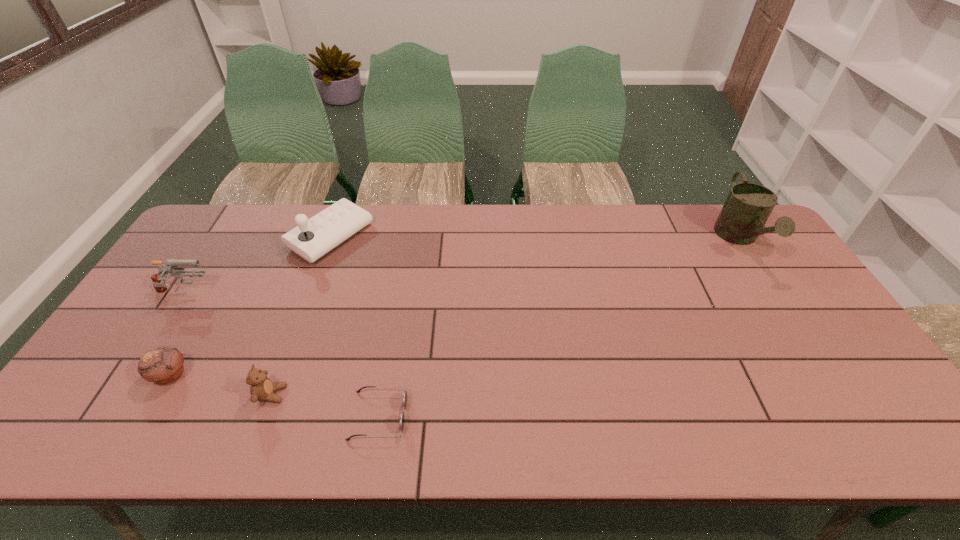
This screenshot has width=960, height=540. In order to click on object that is at the right edge in this screenshot , I will do `click(748, 206)`.

At what (x,y) coordinates should I click in order to perform the action: click on object present at the far right corner. Please return your answer as a coordinate pair (x, y). The height and width of the screenshot is (540, 960). Looking at the image, I should click on (748, 206).

You are a GUI agent. You are given a task and a screenshot of the screen. Output one action in this format:
    pyautogui.click(x=<x>, y=<y>)
    Task: Click on the blank area at the far edge
    
    Given the screenshot: What is the action you would take?
    pyautogui.click(x=628, y=228)

This screenshot has height=540, width=960. I want to click on vacant space at the near edge of the desktop, so tap(608, 435).

I want to click on vacant region at the left edge of the desktop, so click(142, 384).

Find the location of a particular element. vacant region at the right edge is located at coordinates (784, 286).

Where is `vacant area that lies between the muffin and the joystick`? vacant area that lies between the muffin and the joystick is located at coordinates (251, 306).

Find the location of a particular element. Image resolution: width=960 pixels, height=540 pixels. free point between the sunglasses and the gun is located at coordinates (281, 355).

What are the coordinates of `free point between the fifth object from left to right and the third farthest object` in the screenshot? It's located at (281, 355).

At what (x,y) coordinates should I click in order to perform the action: click on free space that is in between the watering can and the gun. Please return your answer as a coordinate pair (x, y). Looking at the image, I should click on (462, 266).